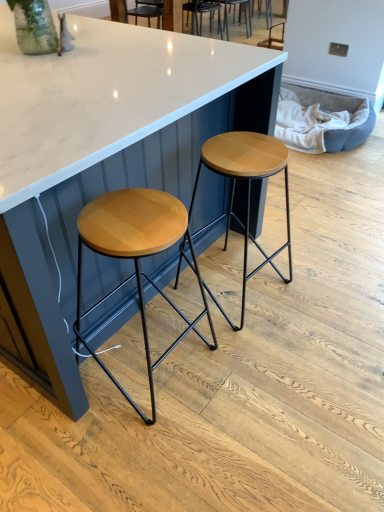
This screenshot has height=512, width=384. I want to click on vacant area that lies between woodenmaterial/texturestool at left, arranged as the first stool when viewed from the left, and wooden matte stool at center, which is the 2th stool in left-to-right order, so click(x=192, y=336).